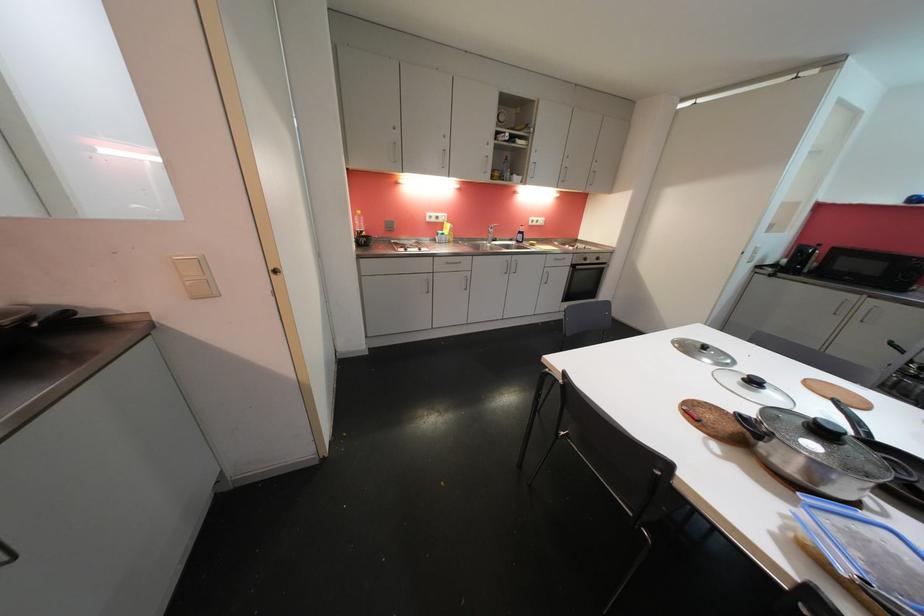
Image resolution: width=924 pixels, height=616 pixels. What are the coordinates of `oven door handle` in the screenshot? It's located at (591, 264).